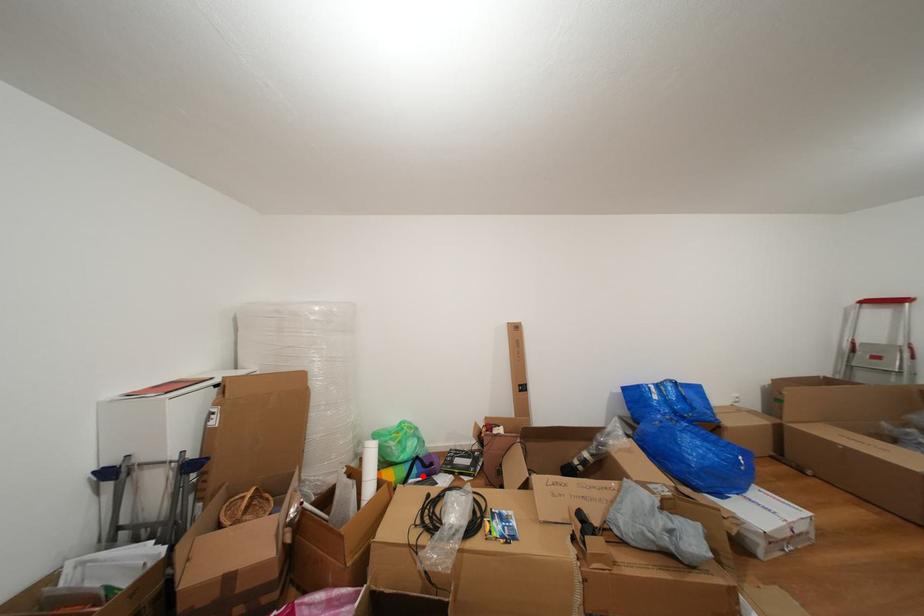
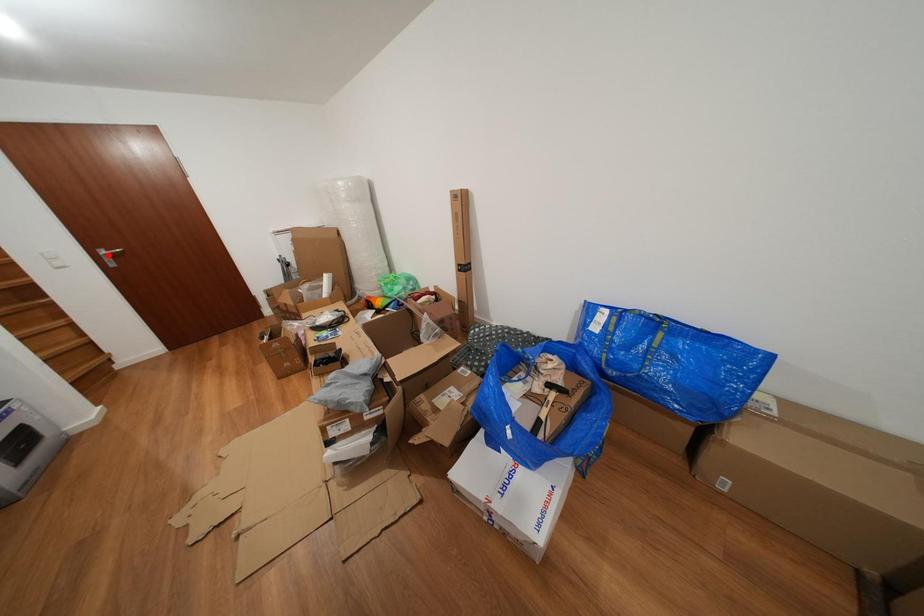
I am providing you with two images of the same scene from different viewpoints. A red point is marked on the first image and another point is marked on the second image. Does the point marked in image1 correspond to the same location as the one in image2?

No